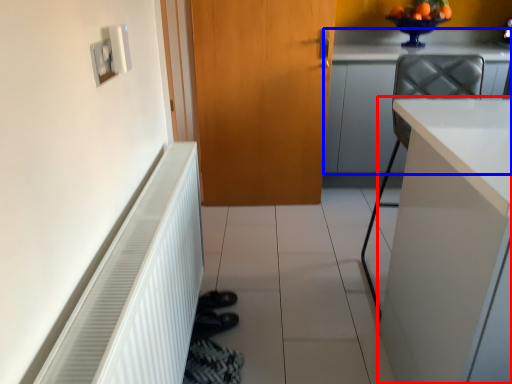
Question: Which point is closer to the camera, cabinetry (highlighted by a red box) or cabinetry (highlighted by a blue box)?

Choices:
 (A) cabinetry
 (B) cabinetry

Answer: (A)